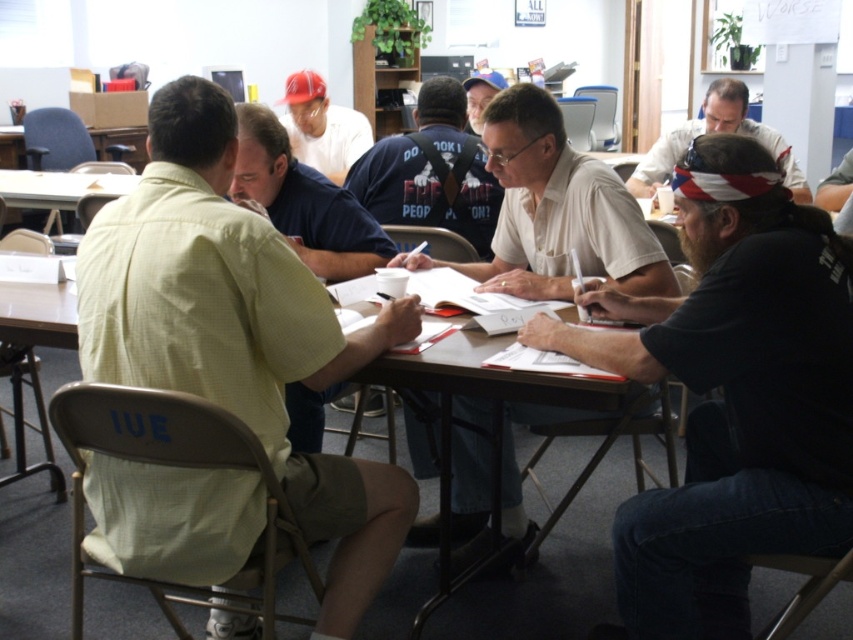
Question: Can you confirm if white paper at center is positioned above brown wooden table at left?

Choices:
 (A) no
 (B) yes

Answer: (A)

Question: Can you confirm if light yellow shirt at left is positioned to the right of wooden table at center?

Choices:
 (A) no
 (B) yes

Answer: (A)

Question: Which point is closer to the camera taking this photo?

Choices:
 (A) (819, 259)
 (B) (349, 483)
 (C) (660, 170)
 (D) (461, 497)

Answer: (A)

Question: Which point appears farthest from the camera in this image?

Choices:
 (A) (509, 513)
 (B) (422, 204)
 (C) (590, 609)

Answer: (B)

Question: Which point is closer to the camera?

Choices:
 (A) dark brown leather jacket at center
 (B) brown wooden table at left

Answer: (A)

Question: From the image, what is the correct spatial relationship of dark brown leather jacket at center in relation to matte blue shirt at center?

Choices:
 (A) left
 (B) right

Answer: (B)